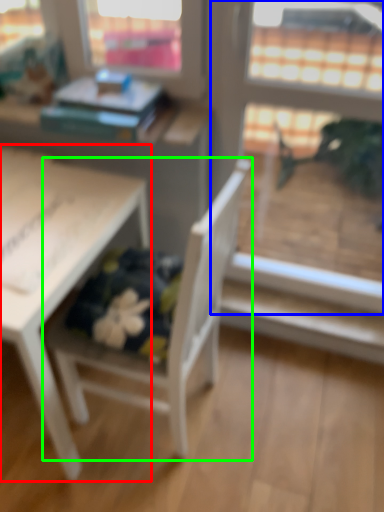
Question: Which is farther away from table (highlighted by a red box)? screen door (highlighted by a blue box) or chair (highlighted by a green box)?

Choices:
 (A) screen door
 (B) chair

Answer: (A)